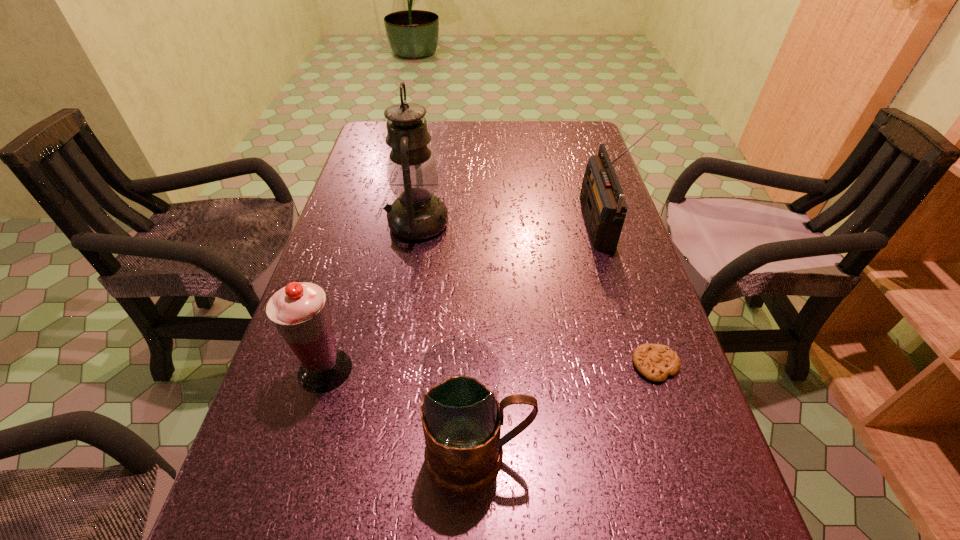
Locate which object ranks in proximity to the radio receiver. Please provide its 2D coordinates. Your answer should be formatted as a tuple, i.e. [(x, y)], where the tuple contains the x and y coordinates of a point satisfying the conditions above.

[(655, 362)]

Identify which object is located as the nearest to the oil lamp. Please provide its 2D coordinates. Your answer should be formatted as a tuple, i.e. [(x, y)], where the tuple contains the x and y coordinates of a point satisfying the conditions above.

[(299, 311)]

Find the location of a particular element. This screenshot has width=960, height=540. vacant region that satisfies the following two spatial constraints: 1. on the front-facing side of the cookie; 2. on the right side of the radio receiver is located at coordinates (640, 364).

Where is `vacant space that satisfies the following two spatial constraints: 1. on the back side of the shortest object; 2. on the front-facing side of the radio receiver`? This screenshot has height=540, width=960. vacant space that satisfies the following two spatial constraints: 1. on the back side of the shortest object; 2. on the front-facing side of the radio receiver is located at coordinates (609, 225).